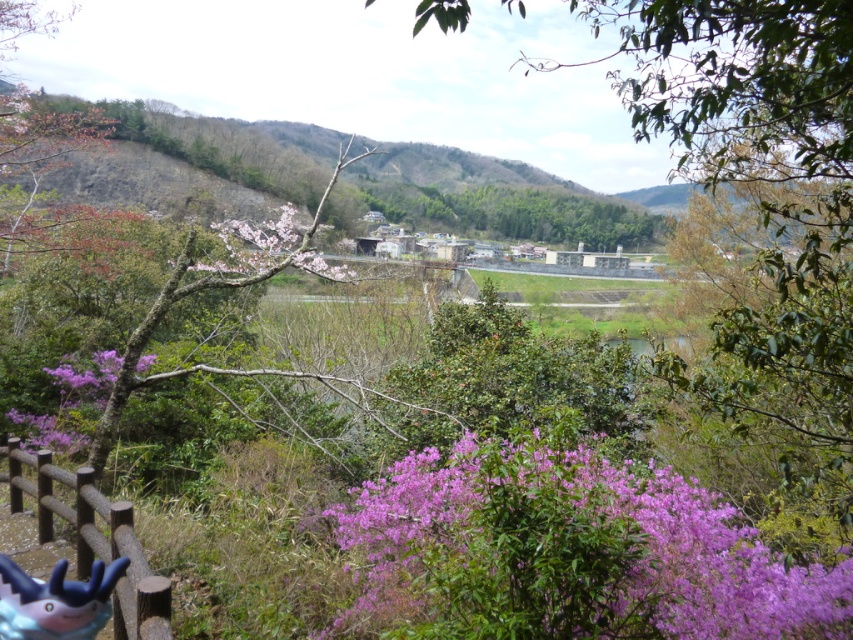
Question: Is pink blossoms at center smaller than purple matte flower at lower left?

Choices:
 (A) no
 (B) yes

Answer: (A)

Question: Which object is closer to the camera taking this photo?

Choices:
 (A) purple matte flower at center-left
 (B) purple matte flower at left
 (C) pink blossoms at center

Answer: (C)

Question: Is purple matte flowers at center wider than purple matte flower at center-left?

Choices:
 (A) yes
 (B) no

Answer: (A)

Question: Which of the following is the farthest from the observer?

Choices:
 (A) purple matte flower at left
 (B) pink blossoms at center

Answer: (A)

Question: Based on their relative distances, which object is farther from the brown wooden rail at lower left?

Choices:
 (A) plastic toy at lower left
 (B) purple leafy bush at lower center

Answer: (B)

Question: Does purple leafy bush at lower center lie behind brown wooden rail at lower left?

Choices:
 (A) yes
 (B) no

Answer: (B)